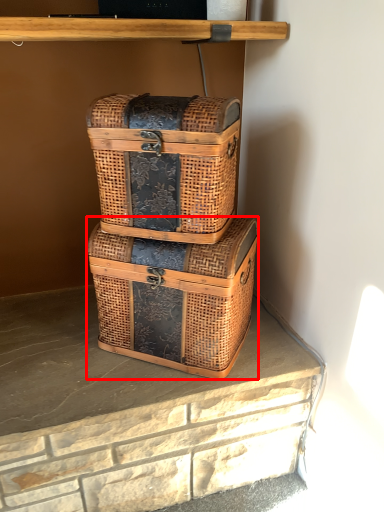
Question: In this image, where is box (annotated by the red box) located relative to box?

Choices:
 (A) right
 (B) left

Answer: (A)